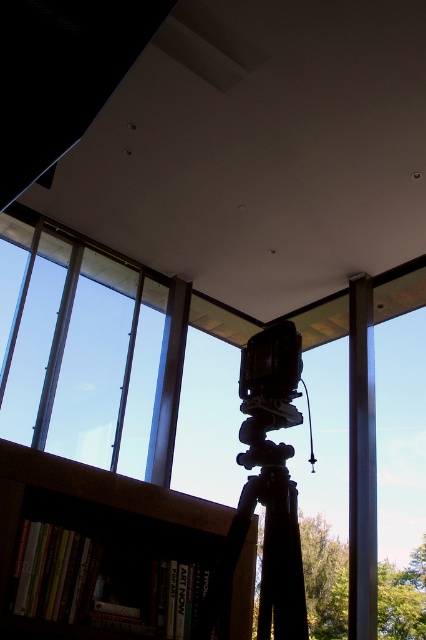
Question: Is metallic pole at center to the right of black plastic video camera at center from the viewer's perspective?

Choices:
 (A) no
 (B) yes

Answer: (B)

Question: Considering the relative positions of metallic pole at center and black plastic video camera at center in the image provided, where is metallic pole at center located with respect to black plastic video camera at center?

Choices:
 (A) right
 (B) left

Answer: (A)

Question: Which point is farther to the camera?

Choices:
 (A) [29, 305]
 (B) [268, 378]

Answer: (A)

Question: Which of the following is the closest to the observer?

Choices:
 (A) metallic pole at center
 (B) black matte tripod at center

Answer: (B)

Question: Does metallic pole at center have a greater width compared to black plastic video camera at center?

Choices:
 (A) yes
 (B) no

Answer: (A)

Question: Which object is positioned closest to the black matte tripod at center?

Choices:
 (A) black plastic video camera at center
 (B) transparent glass window at left
 (C) metallic pole at center

Answer: (A)